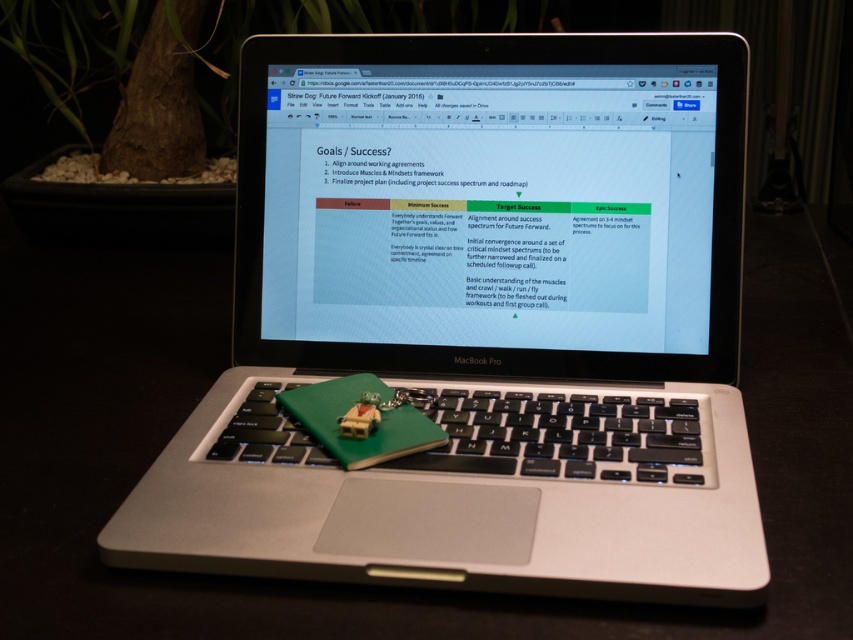
Where is `silver metallic laptop at center`? The width and height of the screenshot is (853, 640). silver metallic laptop at center is located at coordinates (480, 321).

I want to click on silver metallic laptop at center, so click(x=480, y=321).

Where is `silver metallic laptop at center`? The width and height of the screenshot is (853, 640). silver metallic laptop at center is located at coordinates (480, 321).